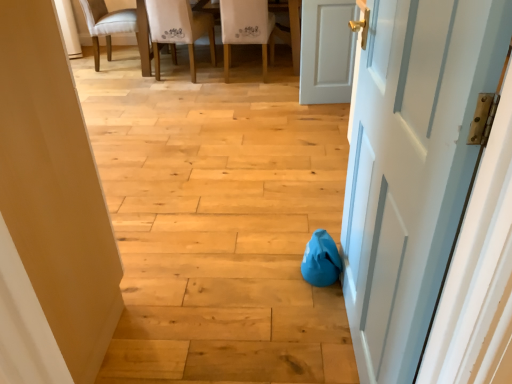
Question: Is white fabric chair at upper center, marked as the second chair in a left-to-right arrangement, situated inside light beige fabric chair at upper left, placed as the third chair when sorted from right to left, or outside?

Choices:
 (A) inside
 (B) outside

Answer: (B)

Question: In terms of size, does white fabric chair at upper center, marked as the second chair in a right-to-left arrangement, appear bigger or smaller than light beige fabric chair at upper left, placed as the third chair when sorted from right to left?

Choices:
 (A) small
 (B) big

Answer: (B)

Question: Estimate the real-world distances between objects in this image. Which object is farther from the white fabric chair at upper center, marked as the second chair in a left-to-right arrangement?

Choices:
 (A) white painted wood door at right, which is counted as the second door, starting from the left
 (B) light beige fabric chair at upper left, placed as the third chair when sorted from right to left
 (C) white fabric chair at upper center, which is counted as the first chair, starting from the right
 (D) white matte door at right, the 3th door from the front
 (E) matte white door at center, the 3th door from the right

Answer: (A)

Question: Which object is the closest to the light beige fabric chair at upper left, which is the first chair in left-to-right order?

Choices:
 (A) white painted wood door at right, which is the first door in front-to-back order
 (B) matte white door at center, the 3th door from the right
 (C) white fabric chair at upper center, which ranks as the 3th chair in left-to-right order
 (D) white fabric chair at upper center, marked as the second chair in a right-to-left arrangement
 (E) white matte door at right, which is counted as the first door, starting from the right

Answer: (D)